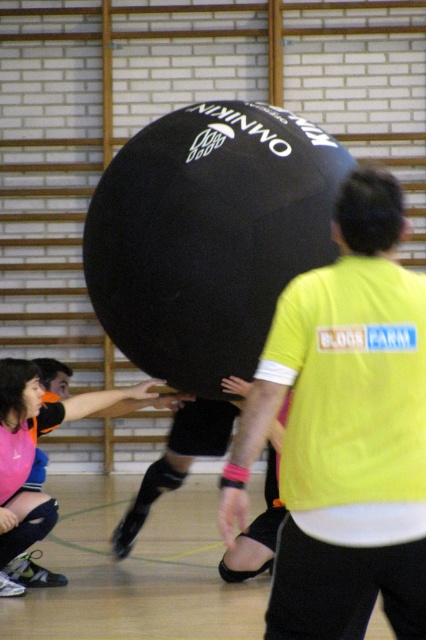
Which is above, yellow fabric shirt at center or matte pink shorts at lower left?

Positioned higher is yellow fabric shirt at center.

Does yellow fabric shirt at center appear under matte pink shorts at lower left?

Incorrect, yellow fabric shirt at center is not positioned below matte pink shorts at lower left.

Which is behind, point (316, 636) or point (20, 554)?

Positioned behind is point (20, 554).

Where is `yellow fabric shirt at center`? Image resolution: width=426 pixels, height=640 pixels. yellow fabric shirt at center is located at coordinates (345, 428).